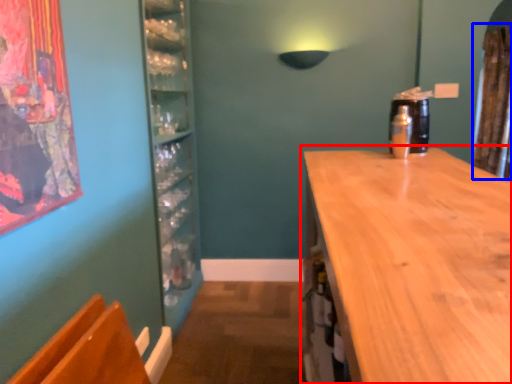
Question: Which object is further to the camera taking this photo, countertop (highlighted by a red box) or curtain (highlighted by a blue box)?

Choices:
 (A) countertop
 (B) curtain

Answer: (B)